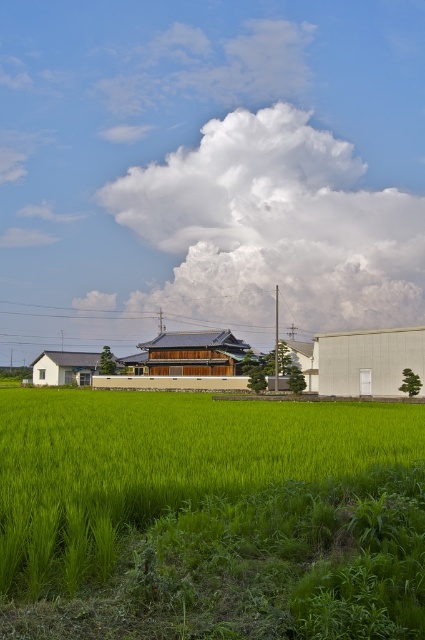
Does point (311, 172) come farther from viewer compared to point (181, 397)?

That is True.

Is white fluffy cloud at upper center taller than green grassy field at center?

Yes.

Is point (207, 272) positioned after point (90, 566)?

Yes, it is.

Identify the location of white fluffy cloud at upper center. (274, 227).